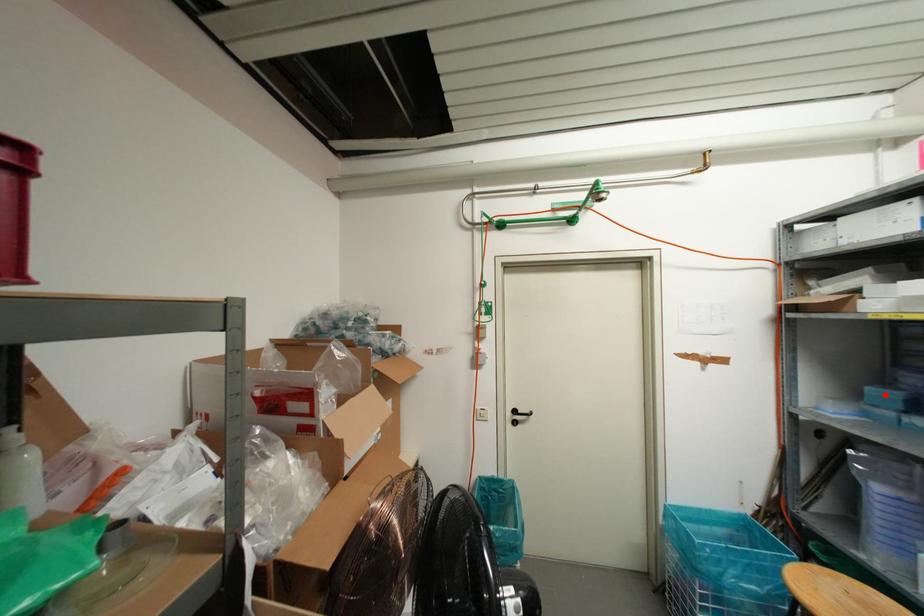
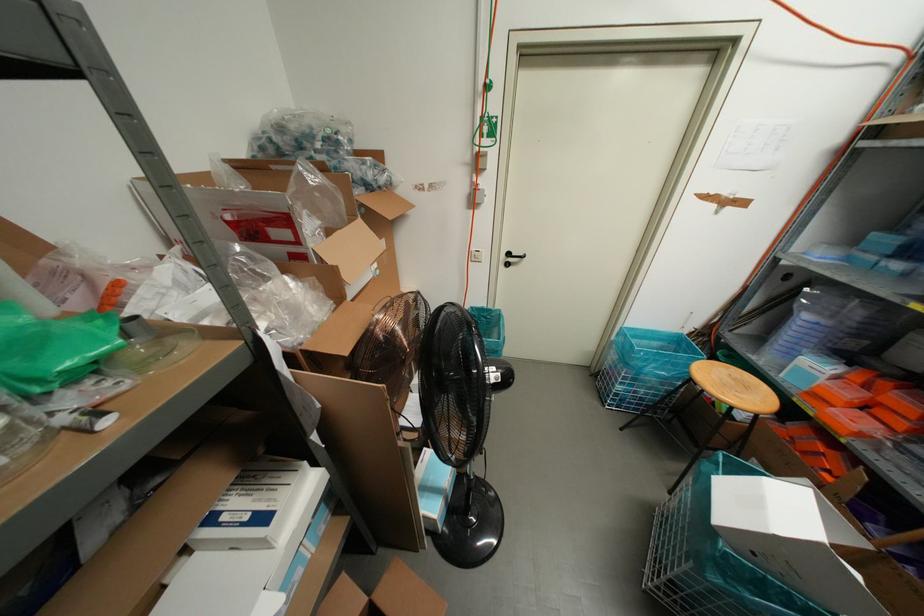
Locate, in the second image, the point that corresponds to the highlighted location in the first image.

(885, 240)